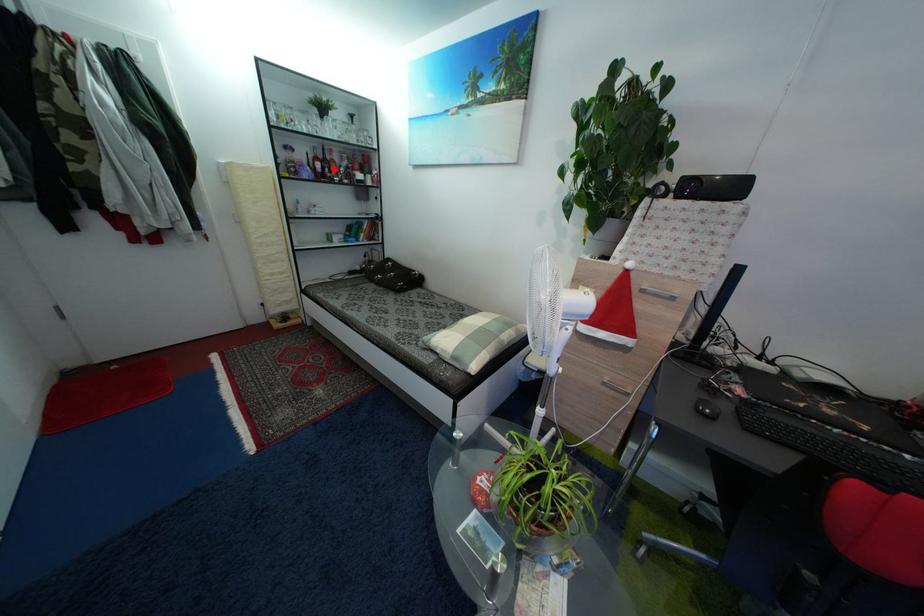
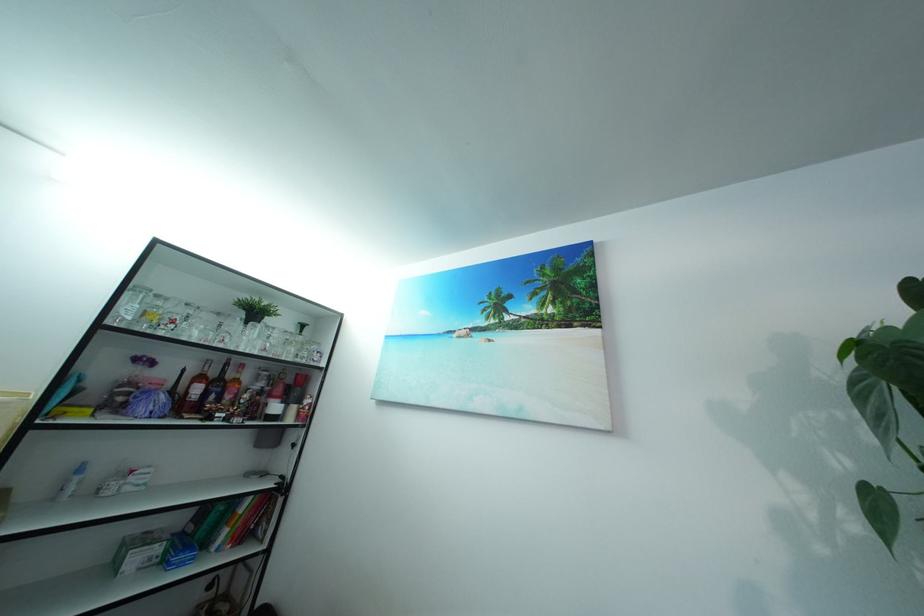
Question: I am providing you with two images of the same scene from different viewpoints. A red point is shown in image1. For the corresponding object point in image2, is it positioned nearer or farther from the camera?

Choices:
 (A) Nearer
 (B) Farther

Answer: (B)